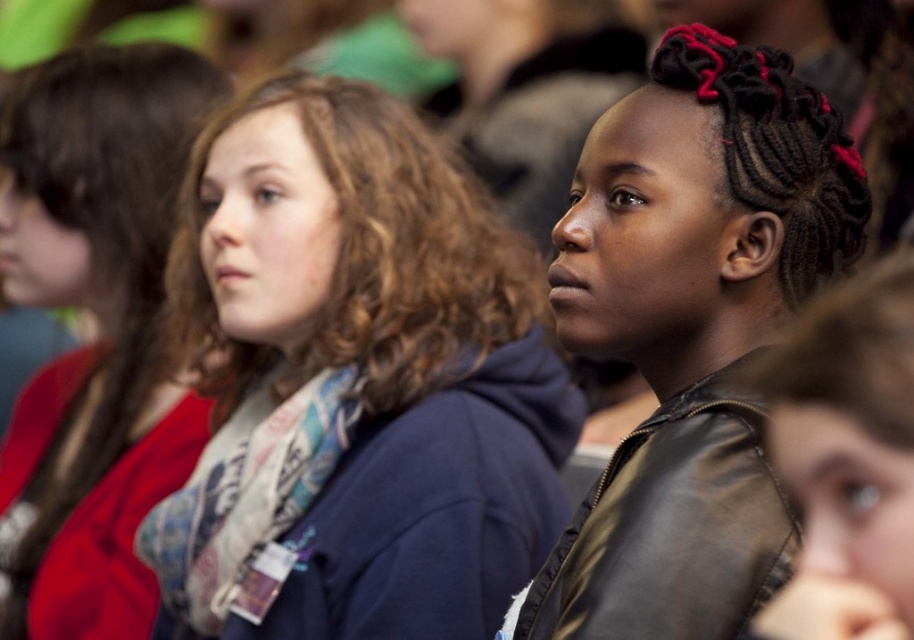
Between matte blue hoodie at center and leather jacket at center, which one is positioned lower?

Positioned lower is leather jacket at center.

Describe the element at coordinates (353, 381) in the screenshot. I see `matte blue hoodie at center` at that location.

This screenshot has width=914, height=640. What are the coordinates of `matte blue hoodie at center` in the screenshot? It's located at (353, 381).

Where is `red scarf at left`? This screenshot has width=914, height=640. red scarf at left is located at coordinates (98, 332).

Does red scarf at left have a smaller size compared to leather jacket at center?

Incorrect, red scarf at left is not smaller in size than leather jacket at center.

At what (x,y) coordinates should I click in order to perform the action: click on red scarf at left. Please return your answer as a coordinate pair (x, y). The image size is (914, 640). Looking at the image, I should click on (98, 332).

Identify the location of black leather jacket at center. The height and width of the screenshot is (640, 914). (689, 332).